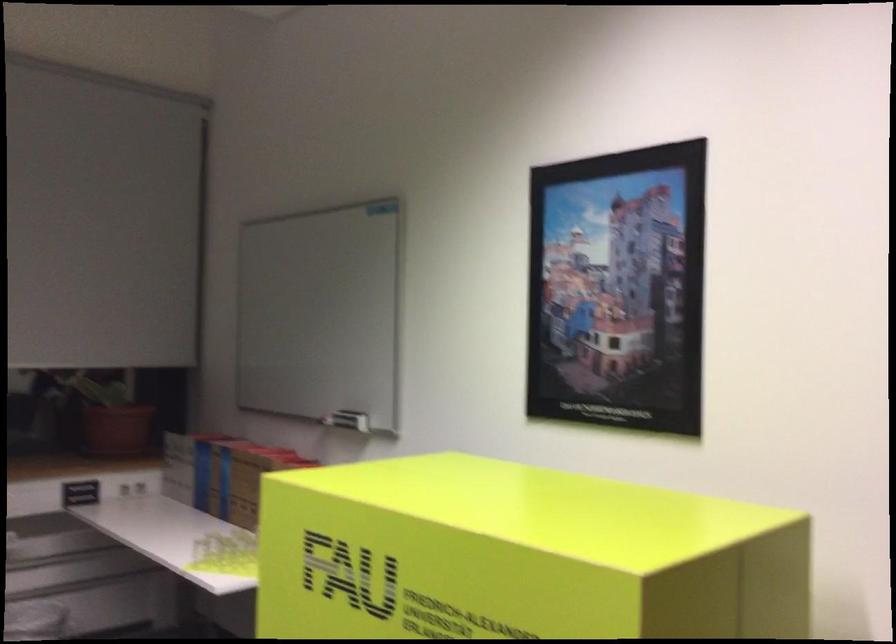
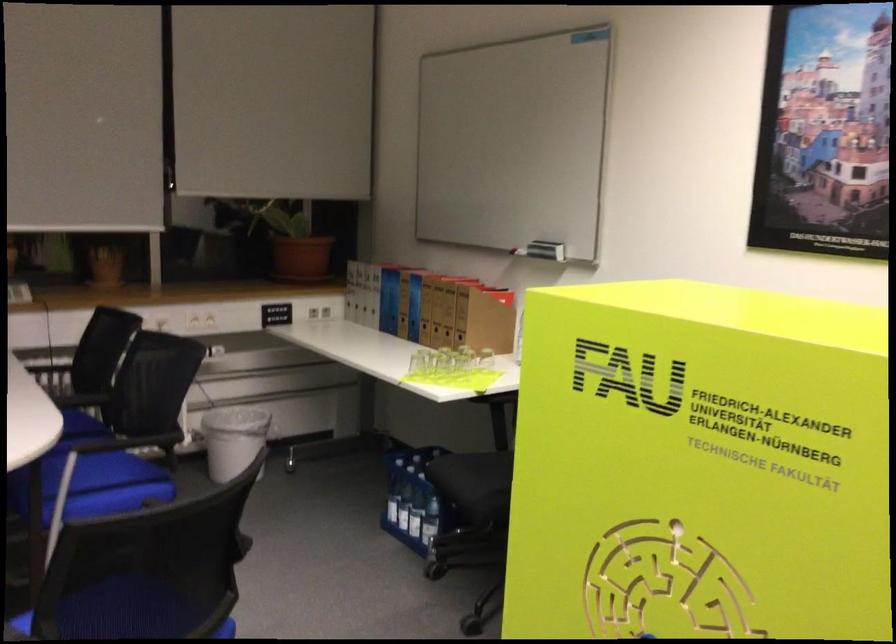
Find the pixel in the second image that matches point (211, 493) in the first image.

(398, 317)